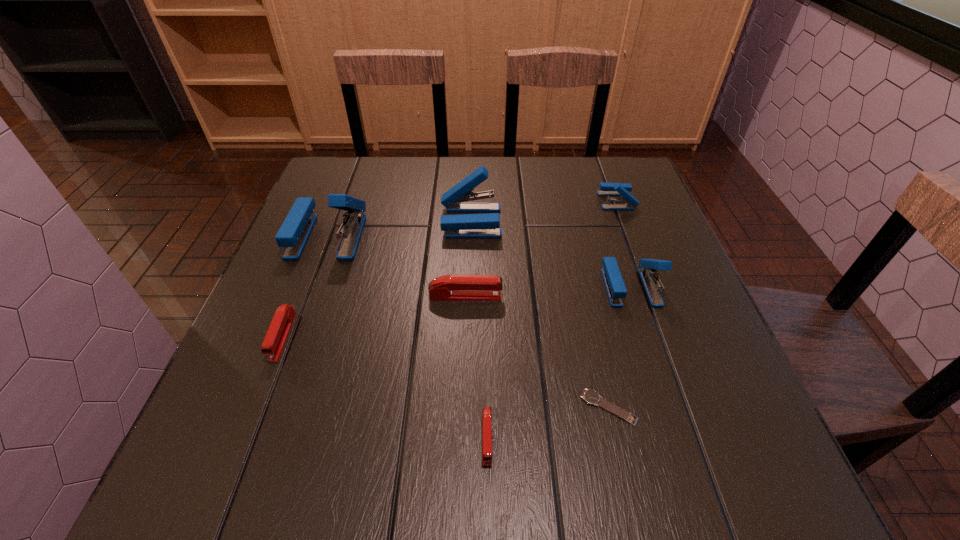
You are a GUI agent. You are given a task and a screenshot of the screen. Output one action in this format:
    pyautogui.click(x=<x>, y=<y>)
    Task: Click on the vacant space that satisfies the following two spatial constraints: 1. on the front-facing side of the third object from right to left; 2. on the left side of the second nearest red stapler
    
    Given the screenshot: What is the action you would take?
    pyautogui.click(x=254, y=408)

Find the location of `vacant space that satisfies the following two spatial constraints: 1. on the front-facing side of the fifth tallest object; 2. on the front-facing side of the second nearest red stapler`. vacant space that satisfies the following two spatial constraints: 1. on the front-facing side of the fifth tallest object; 2. on the front-facing side of the second nearest red stapler is located at coordinates (465, 336).